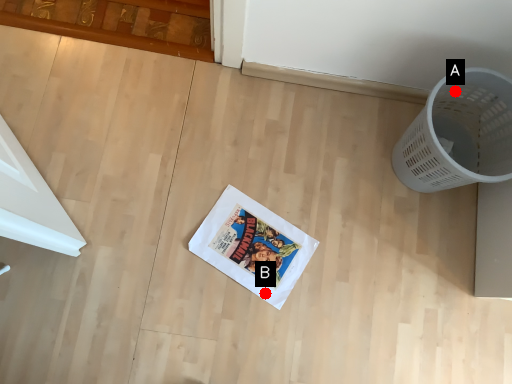
Question: Two points are circled on the image, labeled by A and B beside each circle. Which point is farther from the camera taking this photo?

Choices:
 (A) A is further
 (B) B is further

Answer: (B)